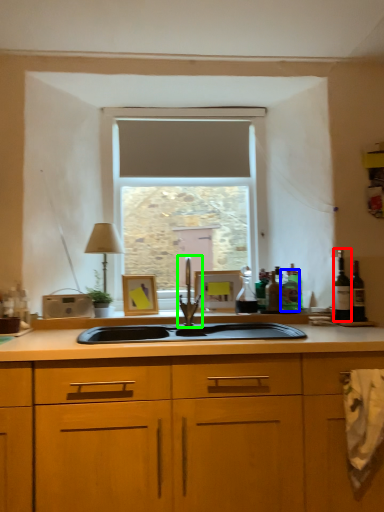
Question: Which is farther away from wine bottle (highlighted by a red box)? bottle (highlighted by a blue box) or tap (highlighted by a green box)?

Choices:
 (A) bottle
 (B) tap

Answer: (B)